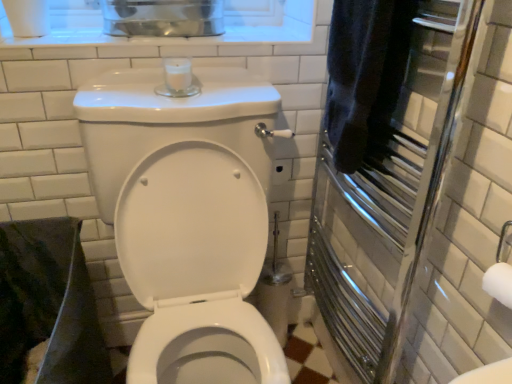
Describe the element at coordinates (188, 218) in the screenshot. I see `white glossy toilet at center` at that location.

In order to click on dark blue towel at right in this screenshot , I will do `click(365, 76)`.

What is the approximate height of polished chrome towel warmer at right?

37.15 inches.

What are the coordinates of `white glossy toilet at center` in the screenshot? It's located at (188, 218).

Would you say white glossy toilet at center contains polished chrome towel warmer at right?

No, polished chrome towel warmer at right is not a part of white glossy toilet at center.

Looking at their sizes, would you say white glossy toilet at center is wider or thinner than polished chrome towel warmer at right?

white glossy toilet at center is wider than polished chrome towel warmer at right.

Which of these two, white glossy toilet at center or polished chrome towel warmer at right, is bigger?

A: Bigger between the two is white glossy toilet at center.

Is point (254, 87) positioned before point (391, 275)?

No, it is behind (391, 275).

Which object is closer to the camera, polished chrome towel warmer at right or dark blue towel at right?

polished chrome towel warmer at right is closer to the camera.

Considering the relative positions of polished chrome towel warmer at right and dark blue towel at right in the image provided, is polished chrome towel warmer at right to the left or to the right of dark blue towel at right?

Based on their positions, polished chrome towel warmer at right is located to the right of dark blue towel at right.

In the scene shown: From the image's perspective, which is above, polished chrome towel warmer at right or dark blue towel at right?

dark blue towel at right is shown above in the image.

What are the coordinates of `toilet lying in front of the dark blue towel at right` in the screenshot? It's located at (188, 218).

Are dark blue towel at right and white glossy toilet at center located far from each other?

dark blue towel at right is actually quite close to white glossy toilet at center.

Can you confirm if dark blue towel at right is wider than white glossy toilet at center?

No.

Which of these two, dark blue towel at right or white glossy toilet at center, is bigger?

white glossy toilet at center.

From the image's perspective, between white glossy toilet at center and dark blue towel at right, which one is located above?

From the image's view, dark blue towel at right is above.

Can you tell me how much white glossy toilet at center and dark blue towel at right differ in facing direction?

The angular difference between white glossy toilet at center and dark blue towel at right is 88.9 degrees.

Considering the relative positions of white glossy toilet at center and dark blue towel at right in the image provided, is white glossy toilet at center to the right of dark blue towel at right from the viewer's perspective?

No.

Considering the sizes of objects polished chrome towel warmer at right and white glossy toilet at center in the image provided, who is shorter, polished chrome towel warmer at right or white glossy toilet at center?

Standing shorter between the two is polished chrome towel warmer at right.

Which of these two, polished chrome towel warmer at right or white glossy toilet at center, is bigger?

With larger size is white glossy toilet at center.

In the image, is polished chrome towel warmer at right on the left side or the right side of white glossy toilet at center?

Clearly, polished chrome towel warmer at right is on the right of white glossy toilet at center in the image.

From the image's perspective, relative to polished chrome towel warmer at right, is dark blue towel at right above or below?

dark blue towel at right is above polished chrome towel warmer at right.

Which is less distant, (351, 58) or (405, 208)?

Point (351, 58) is positioned closer to the camera compared to point (405, 208).

In the scene shown: Do you think dark blue towel at right is within polished chrome towel warmer at right, or outside of it?

dark blue towel at right is enclosed within polished chrome towel warmer at right.

Locate an element on the screen. toilet that is below the polished chrome towel warmer at right (from the image's perspective) is located at coordinates (188, 218).

Find the location of a particular element. The image size is (512, 384). bath towel that appears above the polished chrome towel warmer at right (from a real-world perspective) is located at coordinates (365, 76).

From the image, which object appears to be farther from polished chrome towel warmer at right, white glossy toilet at center or dark blue towel at right?

Among the two, white glossy toilet at center is located further to polished chrome towel warmer at right.

Considering their positions, is dark blue towel at right positioned further to polished chrome towel warmer at right than white glossy toilet at center?

white glossy toilet at center is positioned further to the anchor polished chrome towel warmer at right.

Looking at this image, from the image, which object appears to be farther from white glossy toilet at center, polished chrome towel warmer at right or dark blue towel at right?

dark blue towel at right lies further to white glossy toilet at center than the other object.

Estimate the real-world distances between objects in this image. Which object is closer to dark blue towel at right, white glossy toilet at center or polished chrome towel warmer at right?

polished chrome towel warmer at right is closer to dark blue towel at right.

Which object lies further to the anchor point white glossy toilet at center, dark blue towel at right or polished chrome towel warmer at right?

dark blue towel at right.

Considering their positions, is polished chrome towel warmer at right positioned closer to dark blue towel at right than white glossy toilet at center?

polished chrome towel warmer at right lies closer to dark blue towel at right than the other object.

The height and width of the screenshot is (384, 512). What are the coordinates of `screen door between dark blue towel at right and white glossy toilet at center in the vertical direction` in the screenshot? It's located at [x=386, y=205].